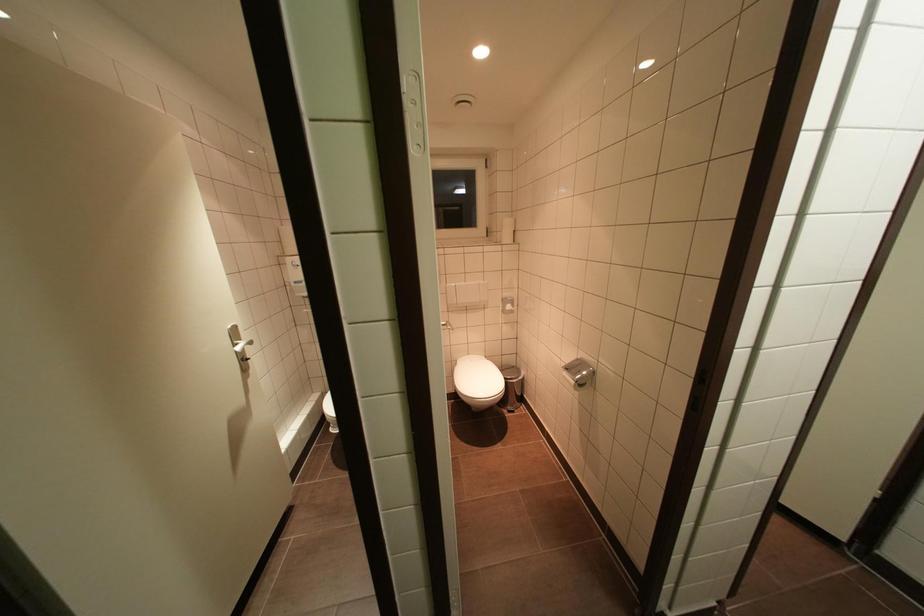
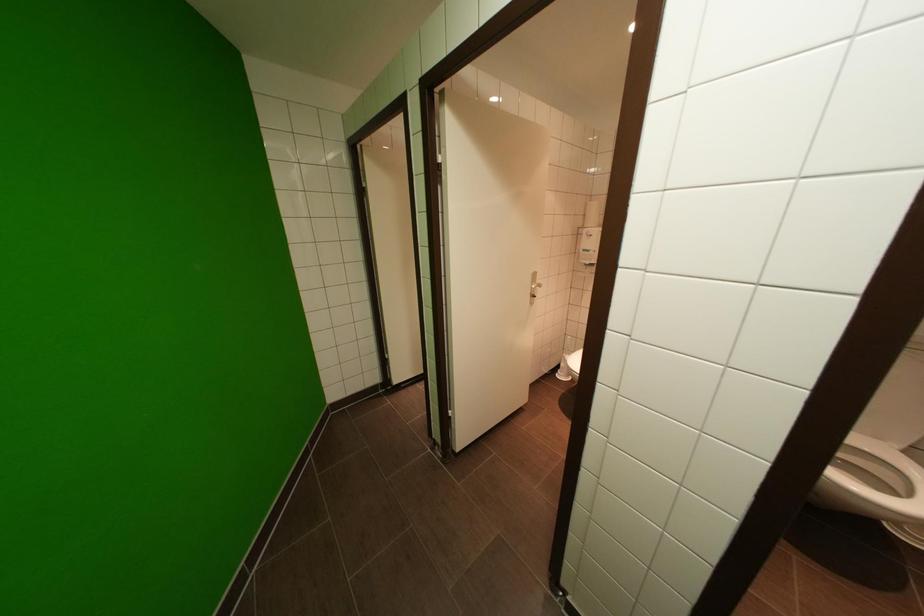
Question: The images are taken continuously from a first-person perspective. In which direction is your viewpoint rotating?

Choices:
 (A) Left
 (B) Right
 (C) Up
 (D) Down

Answer: (A)